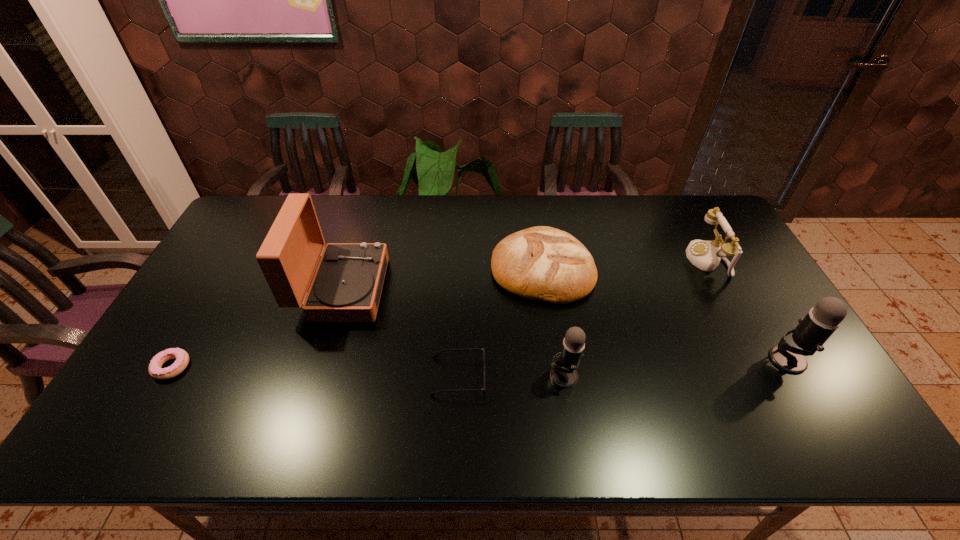
At what (x,y) coordinates should I click in order to perform the action: click on vacant point at the near left corner. Please return your answer as a coordinate pair (x, y). Image resolution: width=960 pixels, height=540 pixels. Looking at the image, I should click on (129, 402).

The width and height of the screenshot is (960, 540). In the image, there is a desktop. What are the coordinates of `vacant area at the near right corner` in the screenshot? It's located at (798, 374).

Find the location of a particular element. The width and height of the screenshot is (960, 540). empty space between the spectacles and the shorter microphone is located at coordinates (511, 376).

Locate an element on the screen. This screenshot has width=960, height=540. vacant area that lies between the spectacles and the bread is located at coordinates (500, 323).

The height and width of the screenshot is (540, 960). Find the location of `free space that is in between the shortest object and the left microphone`. free space that is in between the shortest object and the left microphone is located at coordinates (368, 371).

Locate an element on the screen. free spot between the shorter microphone and the fourth tallest object is located at coordinates (636, 318).

The width and height of the screenshot is (960, 540). I want to click on free space that is in between the telephone and the shorter microphone, so click(636, 318).

Locate an element on the screen. This screenshot has height=540, width=960. vacant area that lies between the spectacles and the leftmost object is located at coordinates (315, 372).

The width and height of the screenshot is (960, 540). Find the location of `free space between the right microphone and the fifth tallest object`. free space between the right microphone and the fifth tallest object is located at coordinates (665, 314).

Identify the location of free space that is in between the fourth shortest object and the doughnut. The height and width of the screenshot is (540, 960). (440, 313).